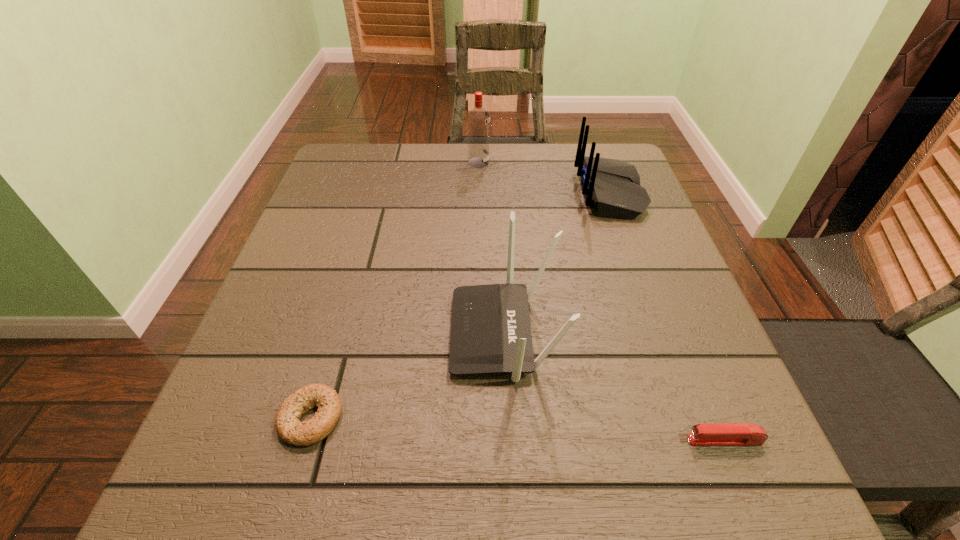
I want to click on vacant point located between the shortest object and the nearer router, so click(408, 376).

You are a GUI agent. You are given a task and a screenshot of the screen. Output one action in this format:
    pyautogui.click(x=<x>, y=<y>)
    Task: Click on the vacant area that lies between the stapler and the shortest object
    Image resolution: width=960 pixels, height=540 pixels.
    Given the screenshot: What is the action you would take?
    pyautogui.click(x=517, y=429)

This screenshot has height=540, width=960. Find the location of `blank region between the stapler and the vodka`. blank region between the stapler and the vodka is located at coordinates 601,301.

This screenshot has height=540, width=960. What are the coordinates of `free area in between the left router and the right router` in the screenshot? It's located at (557, 263).

I want to click on vacant space that is in between the left router and the leftmost object, so click(408, 376).

Image resolution: width=960 pixels, height=540 pixels. Identify the location of vacant area that lies between the vodka and the stapler. (601, 301).

You are a GUI agent. You are given a task and a screenshot of the screen. Output one action in this format:
    pyautogui.click(x=<x>, y=<y>)
    Task: Click on the vacant area that lies between the second shortest object and the right router
    
    Given the screenshot: What is the action you would take?
    pyautogui.click(x=667, y=316)

Locate an element on the screen. The height and width of the screenshot is (540, 960). vacant area that lies between the vodka and the nearer router is located at coordinates (492, 248).

You are a GUI agent. You are given a task and a screenshot of the screen. Output one action in this format:
    pyautogui.click(x=<x>, y=<y>)
    Task: Click on the object that is the third closest to the right router
    
    Given the screenshot: What is the action you would take?
    pyautogui.click(x=727, y=434)

Locate an element on the screen. object that can be found as the third closest to the left router is located at coordinates (612, 186).